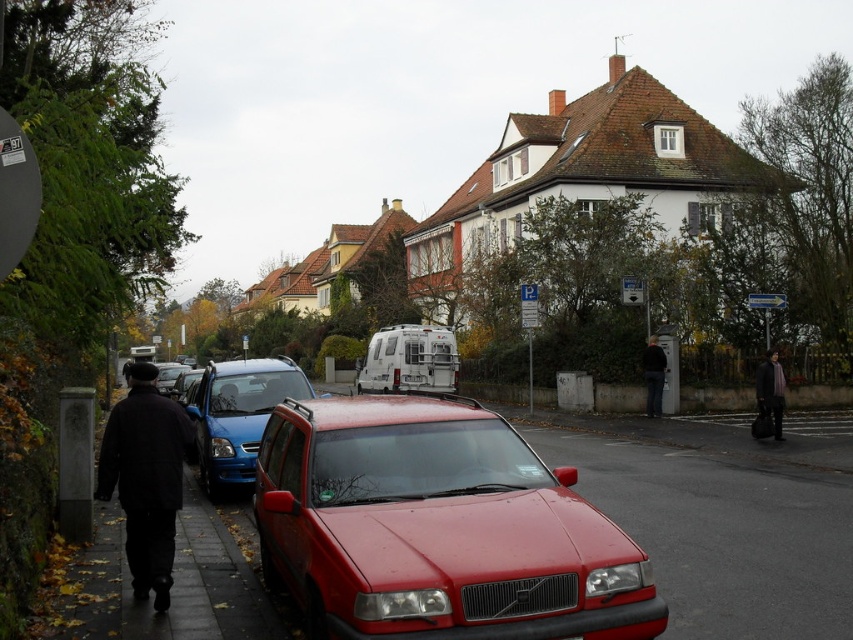
Question: Among these points, which one is nearest to the camera?

Choices:
 (A) (132, 445)
 (B) (215, 390)

Answer: (A)

Question: Is dark gray wool coat at right wider than metallic blue car at center?

Choices:
 (A) yes
 (B) no

Answer: (B)

Question: Considering the real-world distances, which object is closest to the dark gray wool coat at right?

Choices:
 (A) metallic red station wagon at center
 (B) dark gray jacket at center
 (C) white plastic van at center
 (D) metallic red suv at center

Answer: (B)

Question: Is metallic red station wagon at center positioned at the back of dark gray jacket at center?

Choices:
 (A) no
 (B) yes

Answer: (A)

Question: Which of the following is the closest to the observer?

Choices:
 (A) metallic red station wagon at center
 (B) dark gray jacket at center

Answer: (A)

Question: Does metallic red station wagon at center come behind white plastic van at center?

Choices:
 (A) no
 (B) yes

Answer: (A)